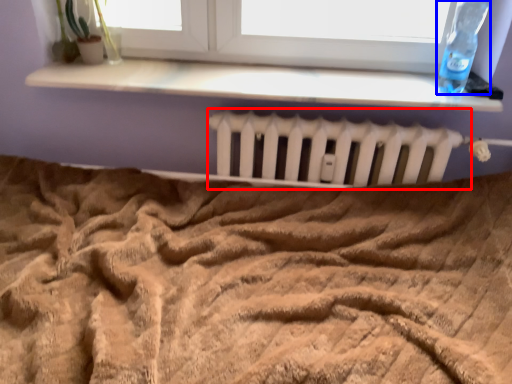
Question: Which of the following is the farthest to the observer, radiator (highlighted by a red box) or bottle (highlighted by a blue box)?

Choices:
 (A) radiator
 (B) bottle

Answer: (A)